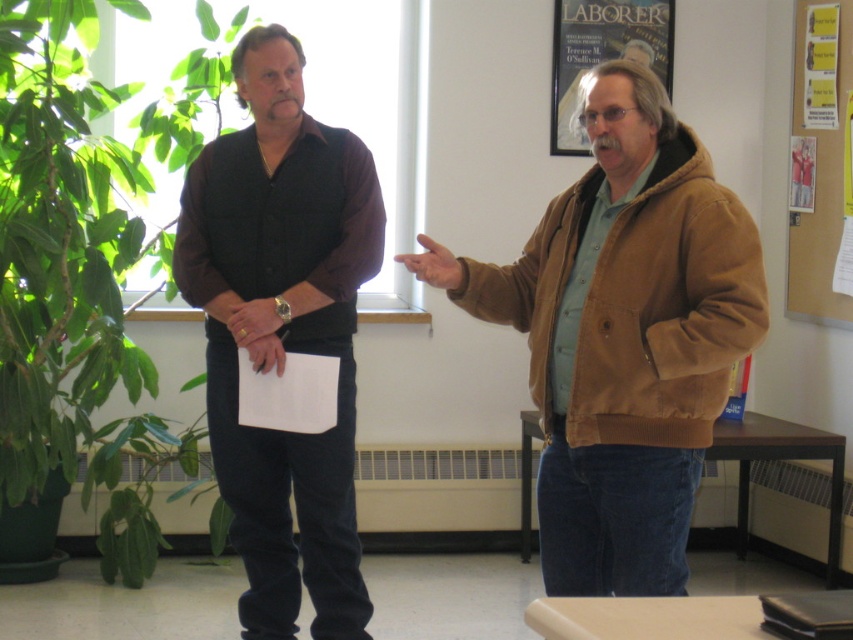
Can you confirm if black matte vest at left is positioned to the right of corkboard at right?

In fact, black matte vest at left is to the left of corkboard at right.

Is point (323, 573) farther from viewer compared to point (837, 38)?

No.

Who is more distant from viewer, (265,36) or (840,102)?

The point (840,102) is more distant.

Locate an element on the screen. This screenshot has height=640, width=853. black matte vest at left is located at coordinates (282, 330).

Is the position of brown suede jacket at right more distant than that of corkboard at right?

No, it is not.

Is brown suede jacket at right shorter than corkboard at right?

Indeed, brown suede jacket at right has a lesser height compared to corkboard at right.

Between point (590, 410) and point (821, 273), which one is positioned behind?

Positioned behind is point (821, 273).

This screenshot has width=853, height=640. I want to click on brown suede jacket at right, so click(x=624, y=337).

Is green leafy plant at left behind black matte vest at left?

Yes, it is behind black matte vest at left.

Can you confirm if green leafy plant at left is smaller than black matte vest at left?

No, green leafy plant at left is not smaller than black matte vest at left.

Is point (42, 291) farther from viewer compared to point (252, 362)?

Yes, point (42, 291) is behind point (252, 362).

I want to click on green leafy plant at left, so click(x=79, y=285).